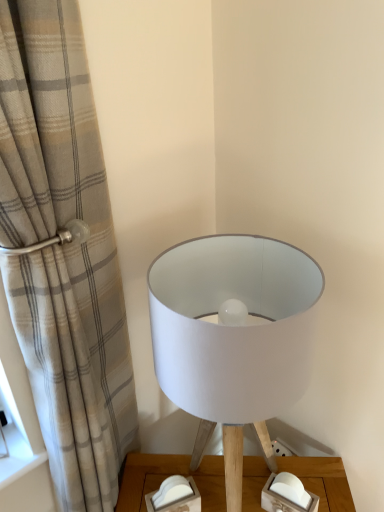
What do you see at coordinates (63, 253) in the screenshot? The height and width of the screenshot is (512, 384). I see `beige plaid curtain at left` at bounding box center [63, 253].

This screenshot has width=384, height=512. I want to click on beige plaid curtain at left, so click(x=63, y=253).

Find the location of `white paper lampshade at center`. white paper lampshade at center is located at coordinates (233, 337).

The width and height of the screenshot is (384, 512). What do you see at coordinates (233, 337) in the screenshot?
I see `white paper lampshade at center` at bounding box center [233, 337].

Looking at this image, what is the approximate width of white paper lampshade at center?

It is 12.12 inches.

The image size is (384, 512). I want to click on beige plaid curtain at left, so [63, 253].

Which is more to the right, beige plaid curtain at left or white paper lampshade at center?

white paper lampshade at center is more to the right.

Is beige plaid curtain at left in front of white paper lampshade at center?

Yes, beige plaid curtain at left is closer to the camera.

Does point (64, 348) come closer to viewer compared to point (277, 356)?

No, it is behind (277, 356).

From the image's perspective, is beige plaid curtain at left above white paper lampshade at center?

Yes.

From a real-world perspective, who is located higher, beige plaid curtain at left or white paper lampshade at center?

From a 3D spatial view, beige plaid curtain at left is above.

Considering the sizes of beige plaid curtain at left and white paper lampshade at center in the image, is beige plaid curtain at left wider or thinner than white paper lampshade at center?

beige plaid curtain at left is thinner than white paper lampshade at center.

Which of these two, beige plaid curtain at left or white paper lampshade at center, stands taller?

beige plaid curtain at left.

Looking at this image, considering the sizes of objects beige plaid curtain at left and white paper lampshade at center in the image provided, who is smaller, beige plaid curtain at left or white paper lampshade at center?

With smaller size is white paper lampshade at center.

Is beige plaid curtain at left inside or outside of white paper lampshade at center?

beige plaid curtain at left cannot be found inside white paper lampshade at center.

Are beige plaid curtain at left and white paper lampshade at center making contact?

No, beige plaid curtain at left is not making contact with white paper lampshade at center.

Based on the photo, is beige plaid curtain at left oriented away from white paper lampshade at center?

No, beige plaid curtain at left's orientation is not away from white paper lampshade at center.

Where is `curtain on the left of the white paper lampshade at center`? curtain on the left of the white paper lampshade at center is located at coordinates (63, 253).

Based on the photo, is white paper lampshade at center at the right side of beige plaid curtain at left?

Yes.

Relative to beige plaid curtain at left, is white paper lampshade at center in front or behind?

Visually, white paper lampshade at center is located behind beige plaid curtain at left.

Considering the points (157, 326) and (23, 19), which point is behind, point (157, 326) or point (23, 19)?

The point (157, 326) is more distant.

From the image's perspective, which one is positioned lower, white paper lampshade at center or beige plaid curtain at left?

white paper lampshade at center is shown below in the image.

From a real-world perspective, which is physically above, white paper lampshade at center or beige plaid curtain at left?

In real-world perspective, beige plaid curtain at left is above.

Is white paper lampshade at center thinner than beige plaid curtain at left?

Incorrect, the width of white paper lampshade at center is not less than that of beige plaid curtain at left.

From the picture: Considering the relative sizes of white paper lampshade at center and beige plaid curtain at left in the image provided, is white paper lampshade at center shorter than beige plaid curtain at left?

Indeed, white paper lampshade at center has a lesser height compared to beige plaid curtain at left.

Considering the sizes of white paper lampshade at center and beige plaid curtain at left in the image, is white paper lampshade at center bigger or smaller than beige plaid curtain at left?

white paper lampshade at center is smaller than beige plaid curtain at left.

Would you say beige plaid curtain at left is part of white paper lampshade at center's contents?

No, beige plaid curtain at left is not a part of white paper lampshade at center.

Would you say white paper lampshade at center is a long distance from beige plaid curtain at left?

No, white paper lampshade at center is not far from beige plaid curtain at left.

Is beige plaid curtain at left at the back of white paper lampshade at center?

No, beige plaid curtain at left is not at the back of white paper lampshade at center.

Image resolution: width=384 pixels, height=512 pixels. Find the location of `lamp to the right of beige plaid curtain at left`. lamp to the right of beige plaid curtain at left is located at coordinates (233, 337).

Where is `lamp to the right of beige plaid curtain at left`? lamp to the right of beige plaid curtain at left is located at coordinates 233,337.

In the image, there is a white paper lampshade at center. At what (x,y) coordinates should I click in order to perform the action: click on curtain above it (from the image's perspective). Please return your answer as a coordinate pair (x, y). Looking at the image, I should click on (63, 253).